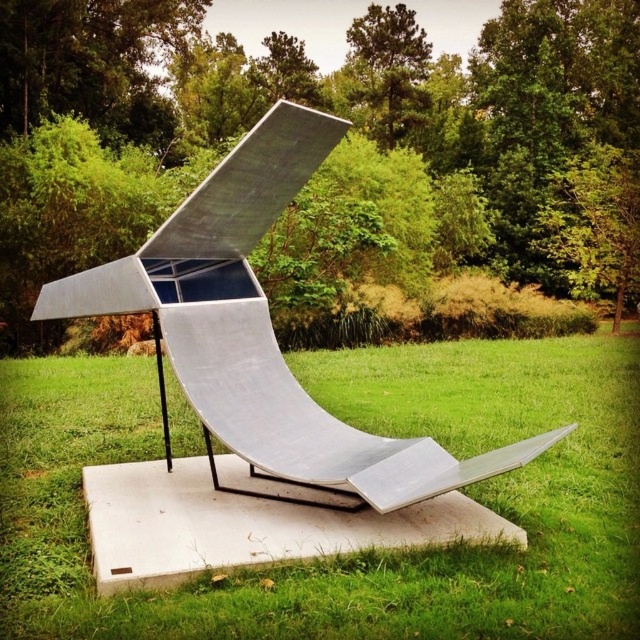
Question: Which point is closer to the camera?

Choices:
 (A) silver polished metal sculpture at center
 (B) green grass at center

Answer: (B)

Question: Which point appears farthest from the camera in this image?

Choices:
 (A) (58, 538)
 (B) (509, 444)

Answer: (B)

Question: Does green grass at center come behind silver polished metal sculpture at center?

Choices:
 (A) yes
 (B) no

Answer: (B)

Question: Which point appears closest to the camera in this image?

Choices:
 (A) (506, 467)
 (B) (138, 394)

Answer: (A)

Question: Is green grass at center to the right of silver polished metal sculpture at center from the viewer's perspective?

Choices:
 (A) no
 (B) yes

Answer: (B)

Question: Is green grass at center thinner than silver polished metal sculpture at center?

Choices:
 (A) yes
 (B) no

Answer: (B)